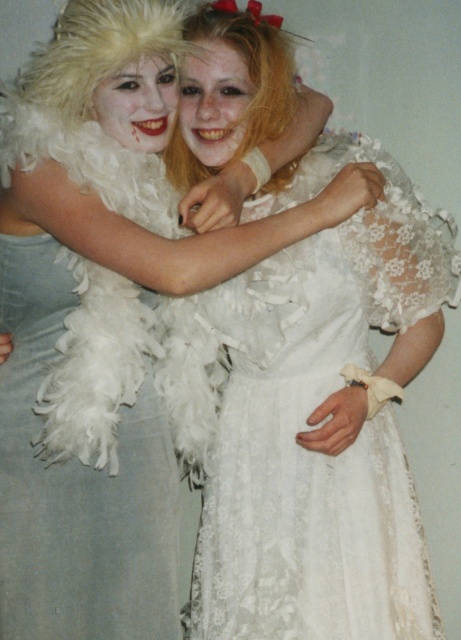
Question: Does white feather boa at left come in front of blonde feather boa at upper center?

Choices:
 (A) yes
 (B) no

Answer: (A)

Question: Where is lace white dress at center located in relation to white feather boa at left in the image?

Choices:
 (A) below
 (B) above

Answer: (B)

Question: Which of the following is the closest to the observer?

Choices:
 (A) (260, 570)
 (B) (28, 289)
 (C) (261, 134)

Answer: (B)

Question: Is the position of lace white dress at center more distant than that of blonde feather boa at upper center?

Choices:
 (A) no
 (B) yes

Answer: (A)

Question: Which object is the farthest from the blonde feather boa at upper center?

Choices:
 (A) lace white dress at center
 (B) white feather boa at left

Answer: (B)

Question: Which object is the farthest from the lace white dress at center?

Choices:
 (A) blonde feather boa at upper center
 (B) white feather boa at left

Answer: (A)